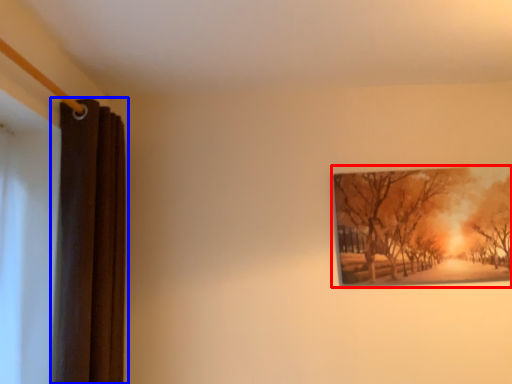
Question: Which object appears closest to the camera in this image, picture frame (highlighted by a red box) or curtain (highlighted by a blue box)?

Choices:
 (A) picture frame
 (B) curtain

Answer: (B)